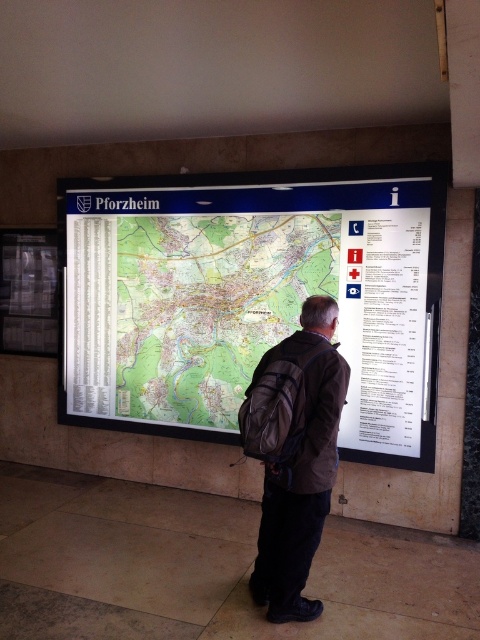
You are the man in the image, and you need to reach the red cross icon on the map. Which object should you look at first, the green paper map at center or the brown fabric backpack at center?

You should look at the green paper map at center first because it is closer to you than the brown fabric backpack at center, so you can check the map to find the location of the red cross icon.

You are standing in a room with a man looking at a map. The map is labeled Pforzheim. Where exactly is the green paper map at center located in the room?

The green paper map at center is located at point (x=250, y=298) in the room.